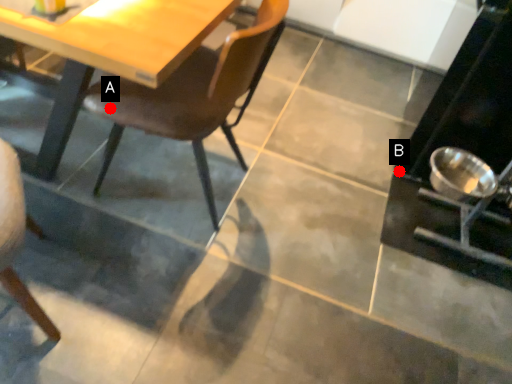
Question: Two points are circled on the image, labeled by A and B beside each circle. Which point is farther from the camera taking this photo?

Choices:
 (A) A is further
 (B) B is further

Answer: (B)